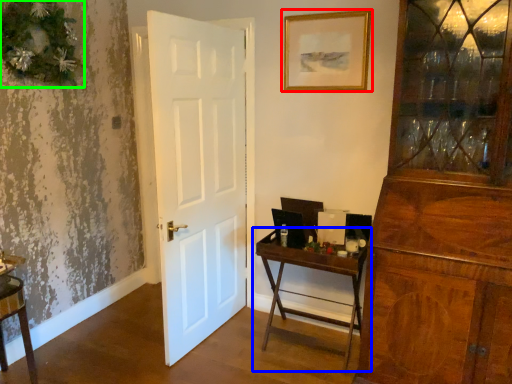
Question: Considering the real-world distances, which object is closest to picture frame (highlighted by a red box)? table (highlighted by a blue box) or christmas decoration (highlighted by a green box).

Choices:
 (A) table
 (B) christmas decoration

Answer: (A)